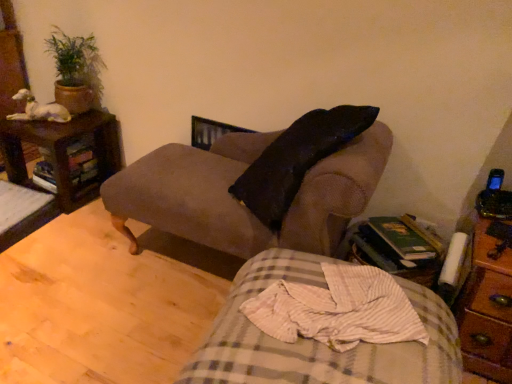
Question: From the image's perspective, relative to white matte statue at upper left, is brown wooden nightstand at right, the second nightstand in the back-to-front sequence, above or below?

Choices:
 (A) above
 (B) below

Answer: (B)

Question: Relative to white matte statue at upper left, is brown wooden nightstand at right, the second nightstand in the back-to-front sequence, in front or behind?

Choices:
 (A) front
 (B) behind

Answer: (A)

Question: Estimate the real-world distances between objects in this image. Which object is farther from the brown wooden nightstand at right, which ranks as the first nightstand in right-to-left order?

Choices:
 (A) suede-like brown couch at center
 (B) green leafy plant in pot at upper left
 (C) brown wooden nightstand at left, which is the second nightstand in front-to-back order
 (D) plaid fabric bed at lower center
 (E) wooden side table at lower right

Answer: (B)

Question: Estimate the real-world distances between objects in this image. Which object is closer to the green leafy plant in pot at upper left?

Choices:
 (A) white matte statue at upper left
 (B) brown wooden nightstand at left, arranged as the second nightstand when ordered from the bottom
 (C) plaid fabric bed at lower center
 (D) wooden side table at lower right
 (E) suede-like brown couch at center

Answer: (A)